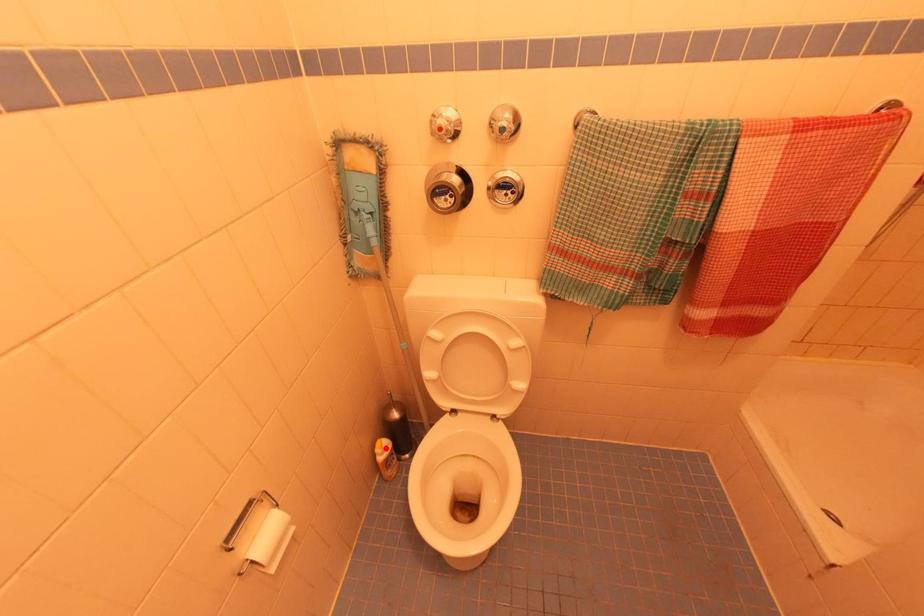
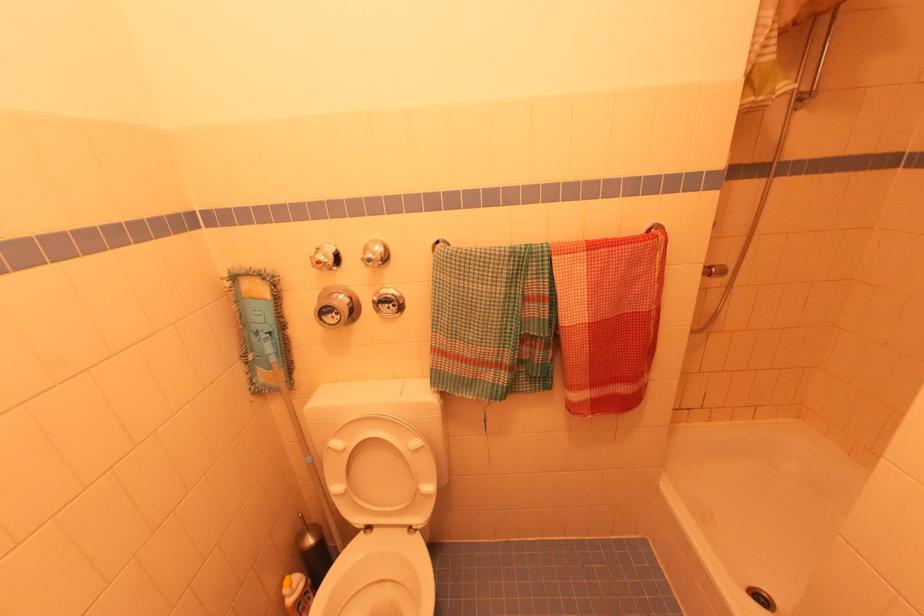
Question: I am providing you with two images of the same scene from different viewpoints. Image1 has a red point marked. In image2, the corresponding 3D location appears at what relative position? Reply with the corresponding letter.

Choices:
 (A) Closer
 (B) Farther

Answer: (B)